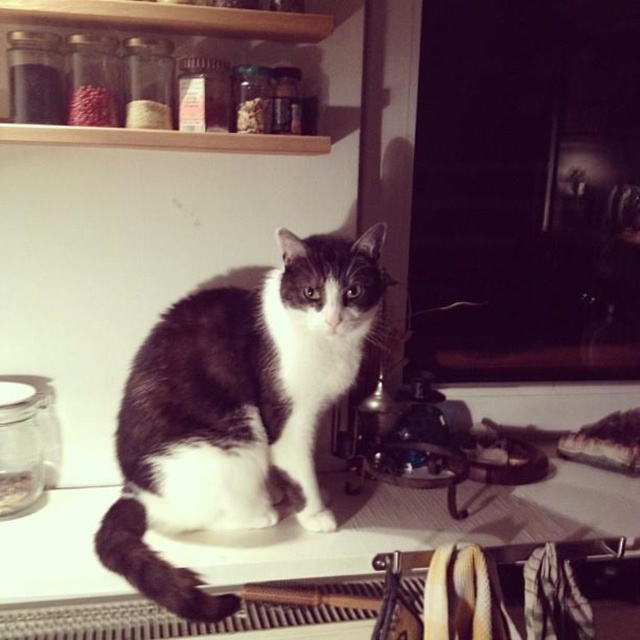
Who is more distant from viewer, (228, 465) or (186, 538)?

Positioned behind is point (186, 538).

Between point (228, 433) and point (353, 513), which one is positioned behind?

The point (353, 513) is behind.

Where is `soft fur cat at center`? soft fur cat at center is located at coordinates (236, 406).

Is white glossy counter top at center bigger than wooden shelf at upper center?

Yes.

Does point (88, 589) come closer to viewer compared to point (13, 140)?

Yes, point (88, 589) is in front of point (13, 140).

The height and width of the screenshot is (640, 640). I want to click on white glossy counter top at center, so click(x=413, y=525).

Between soft fur cat at center and wooden shelf at upper center, which one has more height?

With more height is soft fur cat at center.

Which is behind, point (112, 515) or point (172, 20)?

Point (112, 515)

Locate an element on the screen. soft fur cat at center is located at coordinates (236, 406).

At what (x,y) coordinates should I click in order to perform the action: click on soft fur cat at center. Please return your answer as a coordinate pair (x, y). Looking at the image, I should click on (236, 406).